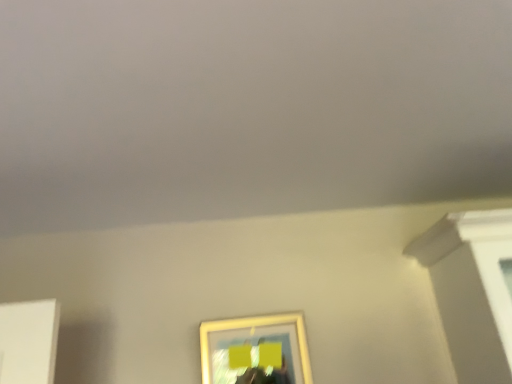
Question: Should I look upward or downward to see matte gold picture frame at lower center?

Choices:
 (A) down
 (B) up

Answer: (A)